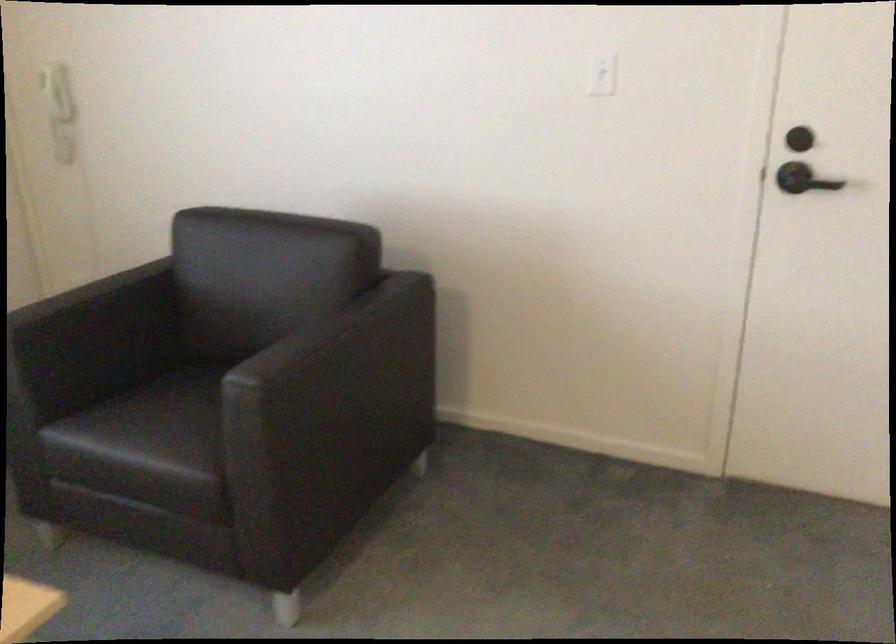
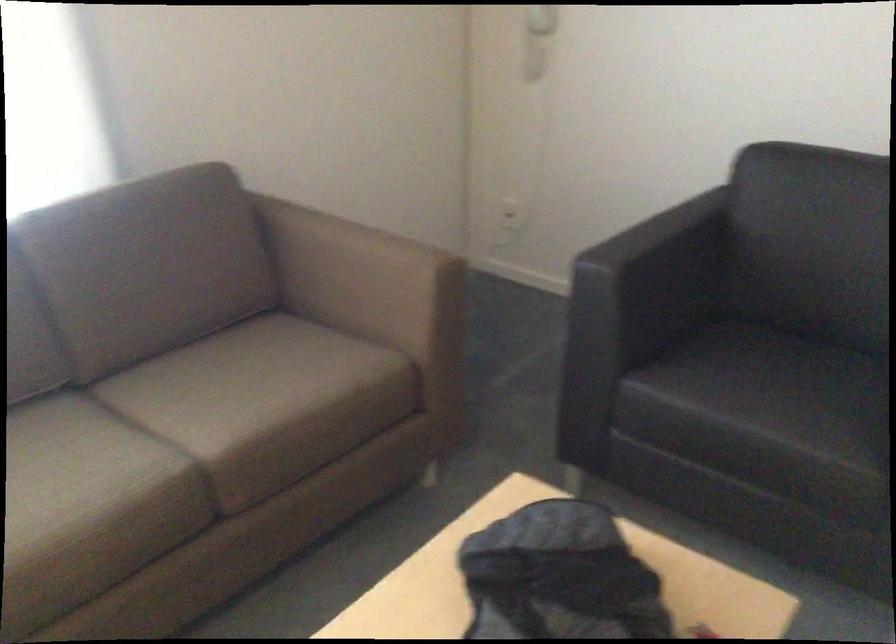
Find the pixel in the second image that matches point 153,430 in the first image.

(765, 397)